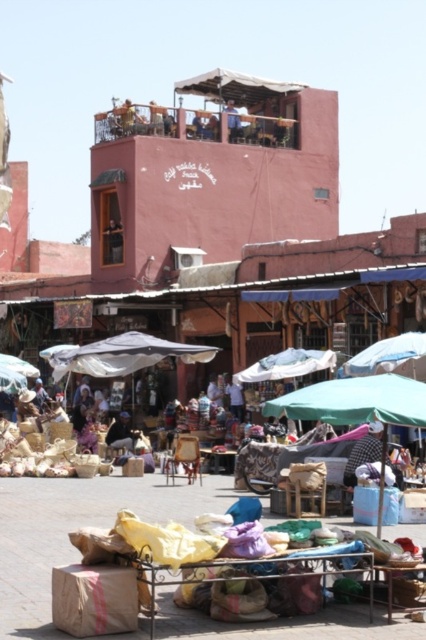
You are a vendor at the market and want to display a new item. You have a large box that is wider than the yellow fabric at center. Can you place it under the blue fabric umbrella at upper center without it sticking out?

The yellow fabric at center is wider than the blue fabric umbrella at upper center. Since your box is wider than the yellow fabric at center, it will be wider than the blue fabric umbrella at upper center as well. Therefore, placing the box under the blue fabric umbrella at upper center would cause it to stick out beyond the umbrella.

You are a vendor at the market and want to display the yellow fabric at center and the white cotton shirt at center on a single table. Which item should you place first to ensure both fit properly?

The yellow fabric at center is bigger than the white cotton shirt at center, so you should place the white cotton shirt at center first to make space for the larger yellow fabric at center.